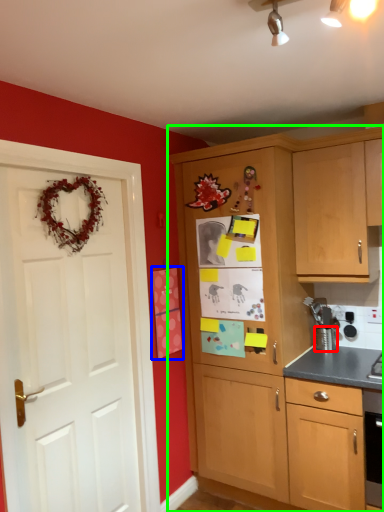
Question: Based on their relative distances, which object is nearer to appliance (highlighted by a red box)? Choose from postcard (highlighted by a blue box) and cabinetry (highlighted by a green box).

Choices:
 (A) postcard
 (B) cabinetry

Answer: (B)